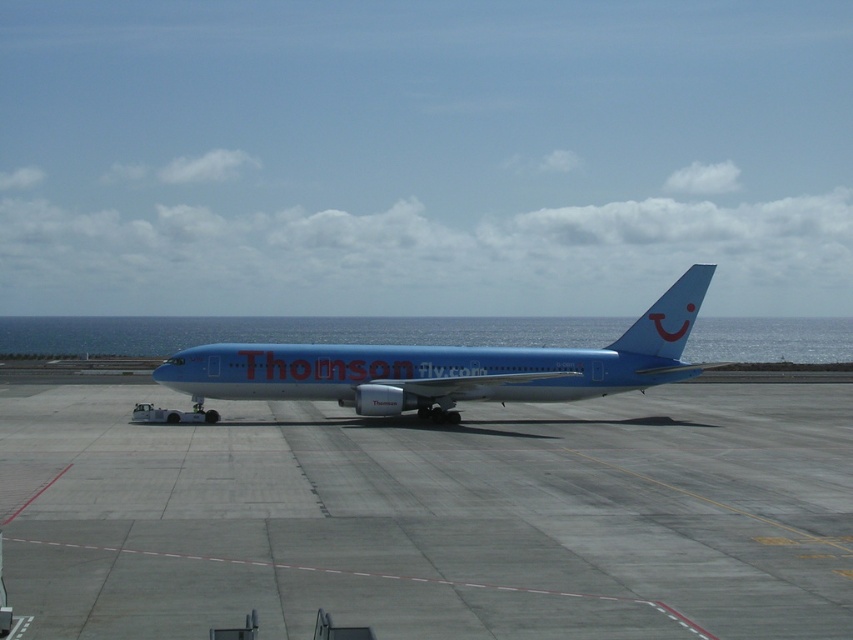
Does smooth concrete tarmac at center have a greater width compared to blue glossy airplane at center?

Indeed, smooth concrete tarmac at center has a greater width compared to blue glossy airplane at center.

Between smooth concrete tarmac at center and blue glossy airplane at center, which one is positioned lower?

smooth concrete tarmac at center

Who is more forward, (x=142, y=490) or (x=427, y=401)?

Point (x=142, y=490) is in front.

Locate an element on the screen. The height and width of the screenshot is (640, 853). smooth concrete tarmac at center is located at coordinates (434, 516).